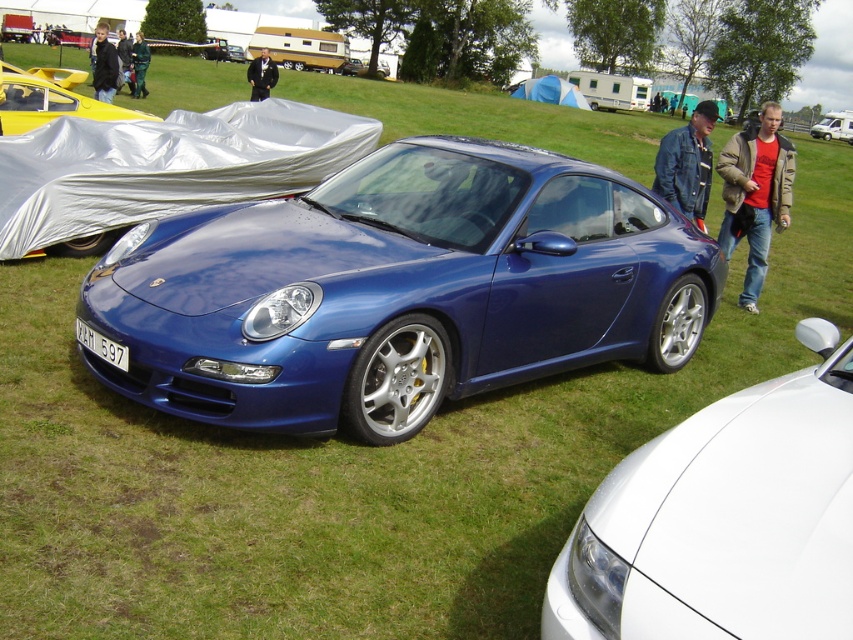
You are standing at the car show and want to walk from point [251,100] to point [225,189]. Based on the scene description, which direction should you move relative to your current position?

You should move forward because point [225,189] is in front of point [251,100].

You are standing in the car show area and see the metallic silver van at upper right and the green fabric jacket at upper left. Which object is positioned to the right of the other?

The metallic silver van at upper right is to the right of the green fabric jacket at upper left.